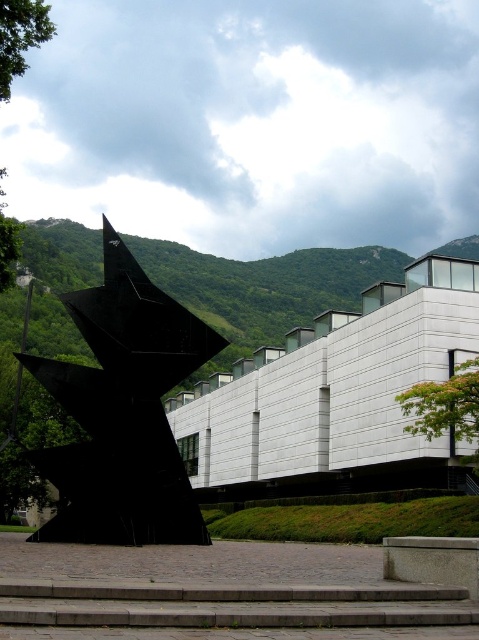
Does black polished sculpture at center have a lesser width compared to green leafy hillside at left?

Yes, black polished sculpture at center is thinner than green leafy hillside at left.

Who is positioned more to the left, black polished sculpture at center or green leafy hillside at left?

black polished sculpture at center

Is point (100, 362) positioned in front of point (159, 244)?

That is True.

The height and width of the screenshot is (640, 479). Identify the location of black polished sculpture at center. (123, 412).

Does black polished sculpture at center appear on the left side of gray concrete stairs at lower center?

Yes, black polished sculpture at center is to the left of gray concrete stairs at lower center.

Who is more distant from viewer, (196, 360) or (0, 596)?

The point (196, 360) is behind.

Between point (107, 330) and point (19, 589), which one is positioned in front?

Point (19, 589)

This screenshot has height=640, width=479. Find the location of `black polished sculpture at center`. black polished sculpture at center is located at coordinates coord(123,412).

Between green leafy hillside at left and gray concrete stairs at lower center, which one has more height?

green leafy hillside at left is taller.

At what (x,y) coordinates should I click in order to perform the action: click on green leafy hillside at left. Please return your answer as a coordinate pair (x, y). The image size is (479, 640). Looking at the image, I should click on (263, 288).

The image size is (479, 640). What are the coordinates of `green leafy hillside at left` in the screenshot? It's located at (263, 288).